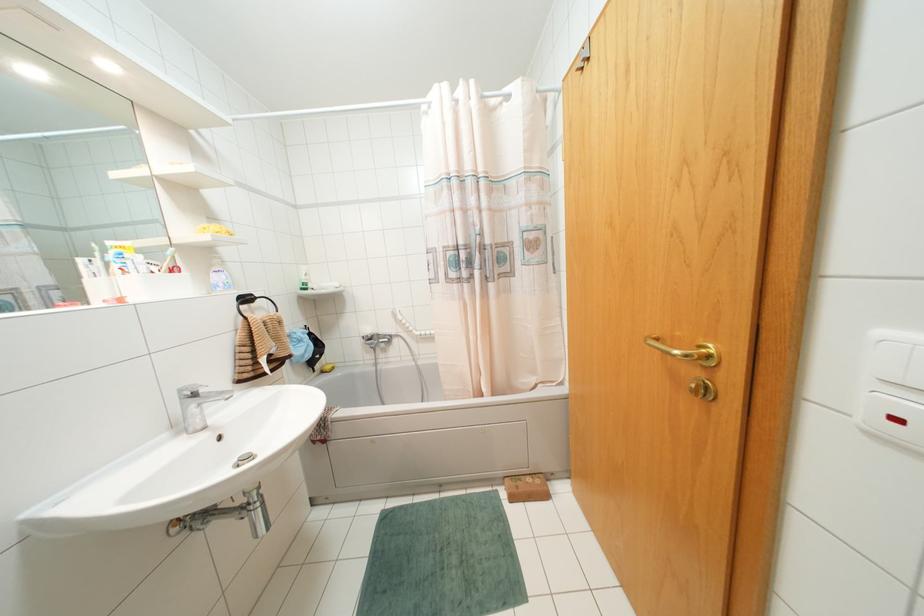
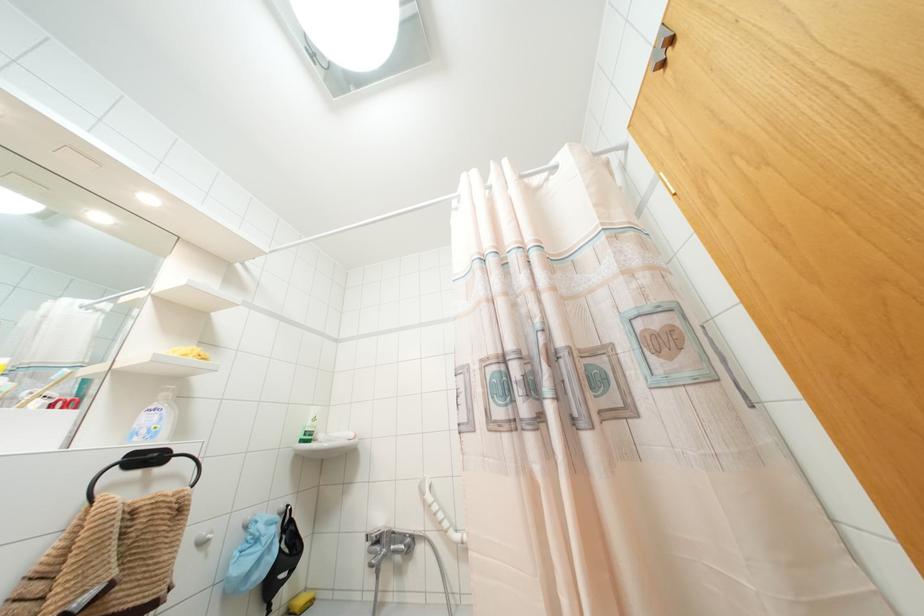
The point at (379,338) is marked in the first image. Where is the corresponding point in the second image?

(390, 541)